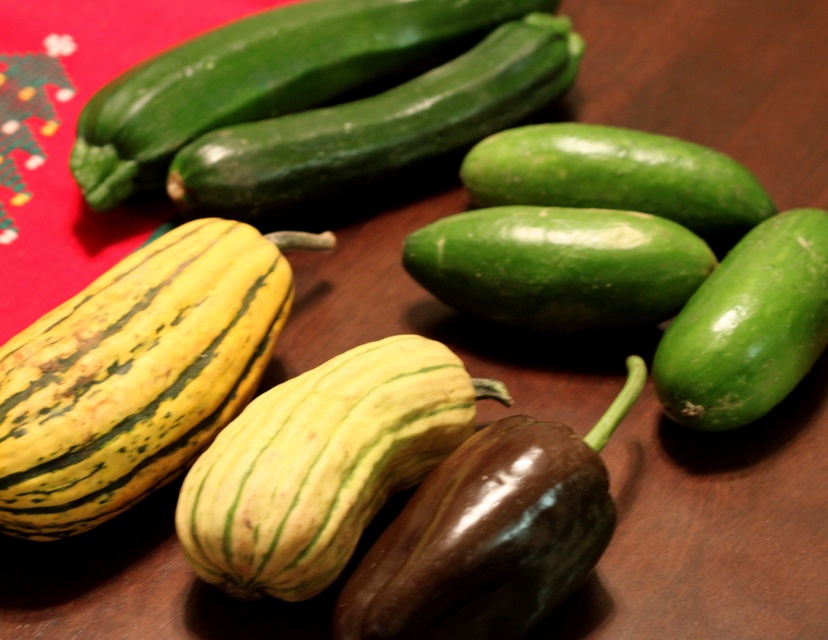
You are a delivery robot with a height of 1.5 meters. You need to pick up the green smooth cucumber at upper center from the wooden surface. Can you reach it without bending down?

The green smooth cucumber at upper center is 1.45 meters away from the camera, so the robot can reach it without bending down since its height is slightly taller than the distance.

Based on the scene description, where is the green matte squash at center located in terms of its 2D coordinates?

The green matte squash at center is located at the 2D coordinates of point (321, 465).

You are looking at the arrangement of vegetables on the wooden surface. There are two specific points marked on the image. Can you determine which of the two points, point (364, 424) or point (626, 392), is closer to you?

Point (364, 424) is closer to the viewer than point (626, 392).